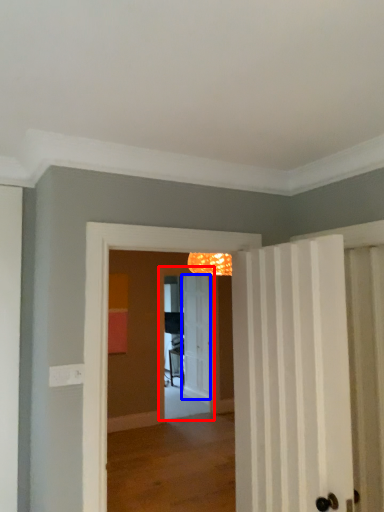
Question: Among these objects, which one is nearest to the camera, screen door (highlighted by a red box) or door (highlighted by a blue box)?

Choices:
 (A) screen door
 (B) door

Answer: (A)